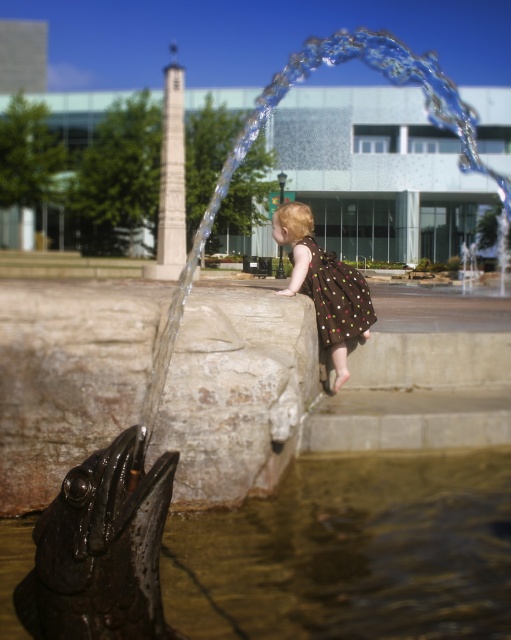
Question: Which object is positioned closest to the brown dotted dress at center?

Choices:
 (A) brown dotted fabric dress at upper center
 (B) shiny metallic fish at lower left

Answer: (A)

Question: Is shiny metallic fish at lower left above brown dotted fabric dress at upper center?

Choices:
 (A) no
 (B) yes

Answer: (A)

Question: Which of these objects is positioned closest to the shiny metallic fish at lower left?

Choices:
 (A) brown dotted fabric dress at upper center
 (B) brown dotted dress at center

Answer: (A)

Question: Is brown dotted dress at center further to the viewer compared to brown dotted fabric dress at upper center?

Choices:
 (A) yes
 (B) no

Answer: (B)

Question: Can you confirm if shiny metallic fish at lower left is smaller than brown dotted fabric dress at upper center?

Choices:
 (A) no
 (B) yes

Answer: (A)

Question: Which point is farther from the camera taking this photo?

Choices:
 (A) (309, 280)
 (B) (221, 564)
 (C) (340, 262)

Answer: (C)